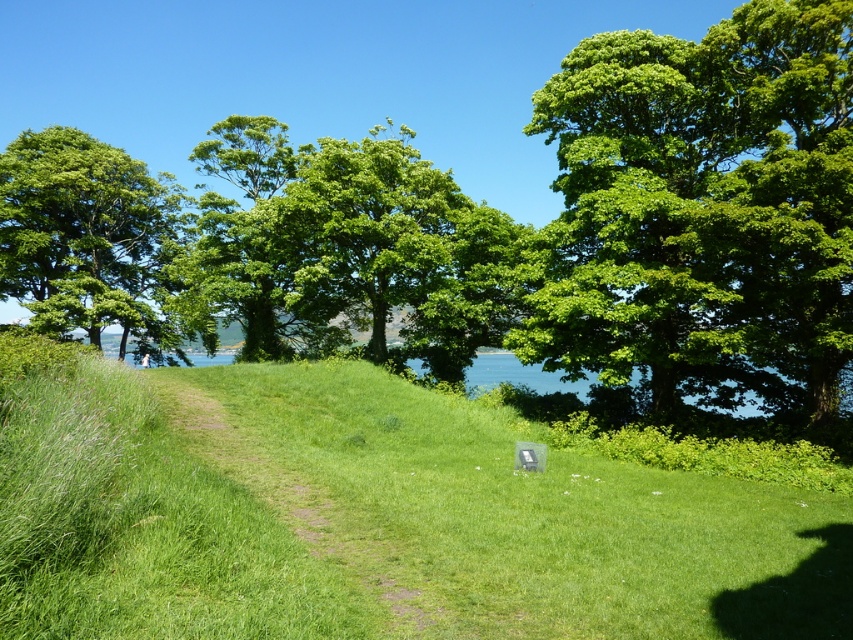
Question: Is green grassy trail at center to the left of green leafy tree at center from the viewer's perspective?

Choices:
 (A) no
 (B) yes

Answer: (A)

Question: Is green grassy trail at center bigger than green leafy tree at center?

Choices:
 (A) yes
 (B) no

Answer: (B)

Question: Is green leafy tree at upper center wider than green leafy tree at center?

Choices:
 (A) no
 (B) yes

Answer: (A)

Question: Which point is closer to the camera?

Choices:
 (A) green leafy tree at center
 (B) green leafy tree at left
 (C) green grassy trail at center
 (D) green leafy tree at upper center

Answer: (C)

Question: Which of the following is the farthest from the observer?

Choices:
 (A) (656, 308)
 (B) (105, 204)
 (C) (218, 138)
 (D) (405, 417)

Answer: (C)

Question: Which point appears farthest from the camera in this image?

Choices:
 (A) (358, 545)
 (B) (33, 257)
 (C) (527, 125)
 (D) (212, 275)

Answer: (B)